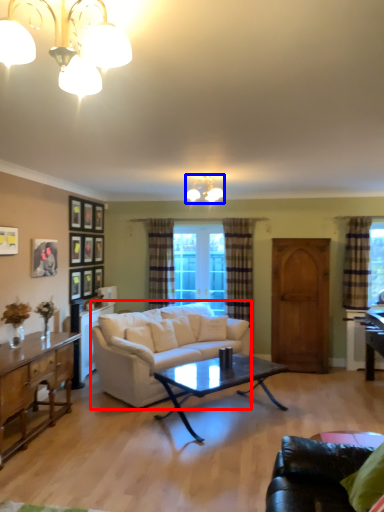
Question: Among these objects, which one is nearest to the camera, studio couch (highlighted by a red box) or lamp (highlighted by a blue box)?

Choices:
 (A) studio couch
 (B) lamp

Answer: (A)